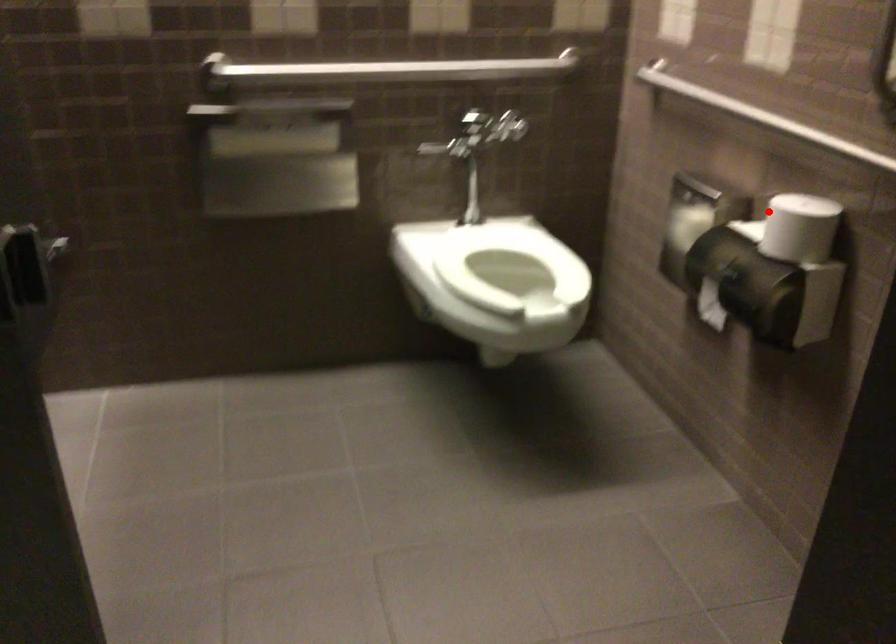
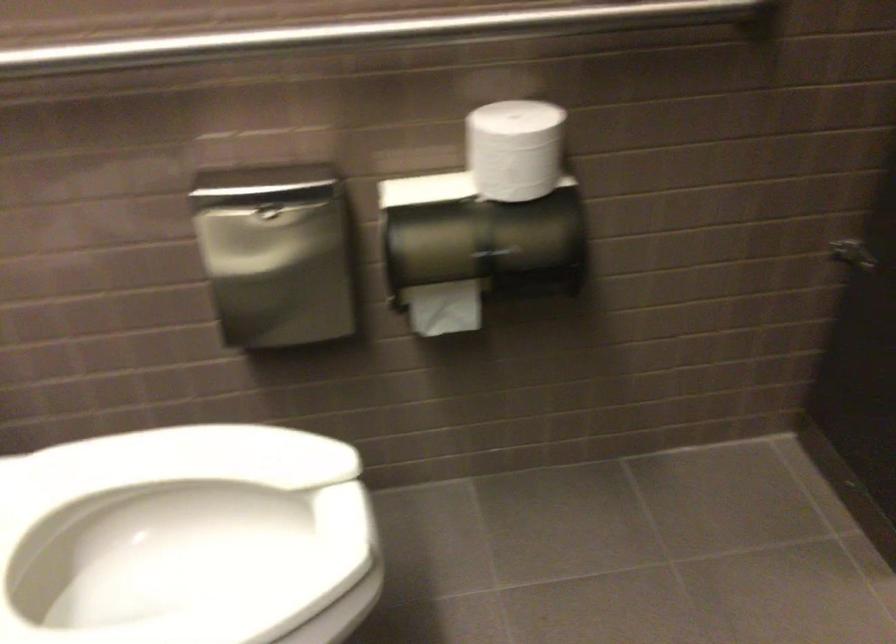
Find the pixel in the second image that matches the highlighted location in the first image.

(514, 149)